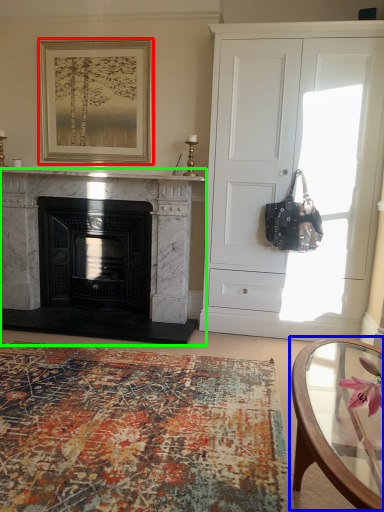
Question: Considering the real-world distances, which object is farthest from picture frame (highlighted by a red box)? coffee table (highlighted by a blue box) or fireplace (highlighted by a green box)?

Choices:
 (A) coffee table
 (B) fireplace

Answer: (A)